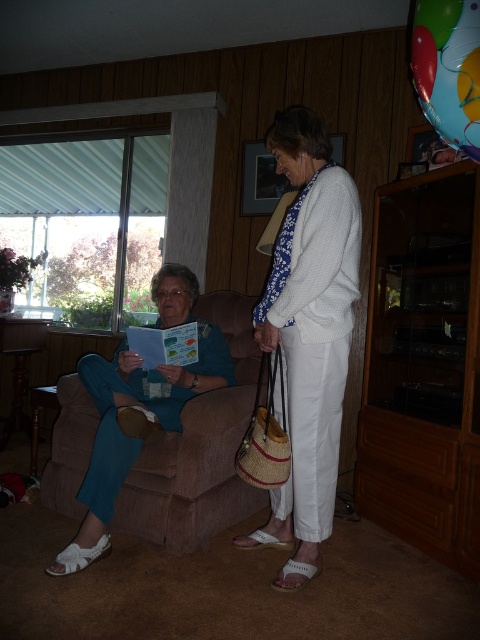
Question: Considering the relative positions of brown fabric couch at lower left and translucent plastic balloon at upper right in the image provided, where is brown fabric couch at lower left located with respect to translucent plastic balloon at upper right?

Choices:
 (A) below
 (B) above

Answer: (A)

Question: Can you confirm if brown fabric couch at lower left is positioned to the right of translucent plastic balloon at upper right?

Choices:
 (A) no
 (B) yes

Answer: (A)

Question: Among these objects, which one is farthest from the camera?

Choices:
 (A) matte blue pants at left
 (B) white woven purse at center
 (C) translucent plastic balloon at upper right

Answer: (A)

Question: Which of these objects is positioned closest to the brown fabric couch at lower left?

Choices:
 (A) white woven purse at center
 (B) matte blue pants at left
 (C) translucent plastic balloon at upper right

Answer: (B)

Question: Which of these objects is positioned closest to the brown fabric couch at lower left?

Choices:
 (A) translucent plastic balloon at upper right
 (B) matte blue pants at left
 (C) white woven purse at center

Answer: (B)

Question: Can you confirm if white woven purse at center is positioned above brown fabric couch at lower left?

Choices:
 (A) yes
 (B) no

Answer: (A)